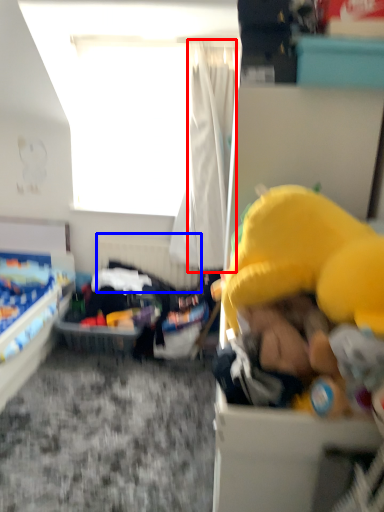
Question: Among these objects, which one is farthest to the camera, curtain (highlighted by a red box) or bed frame (highlighted by a blue box)?

Choices:
 (A) curtain
 (B) bed frame

Answer: (B)